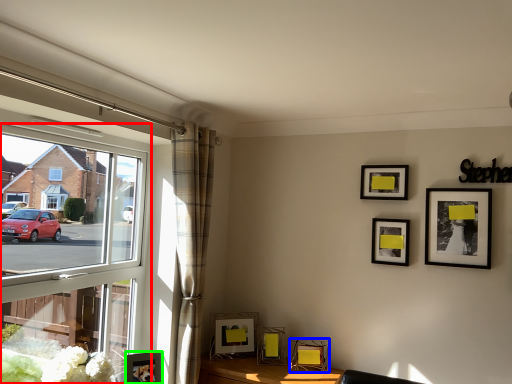
Question: Which object is positioned closest to window (highlighted by a red box)? Select from picture frame (highlighted by a blue box) and picture frame (highlighted by a green box).

Choices:
 (A) picture frame
 (B) picture frame

Answer: (B)